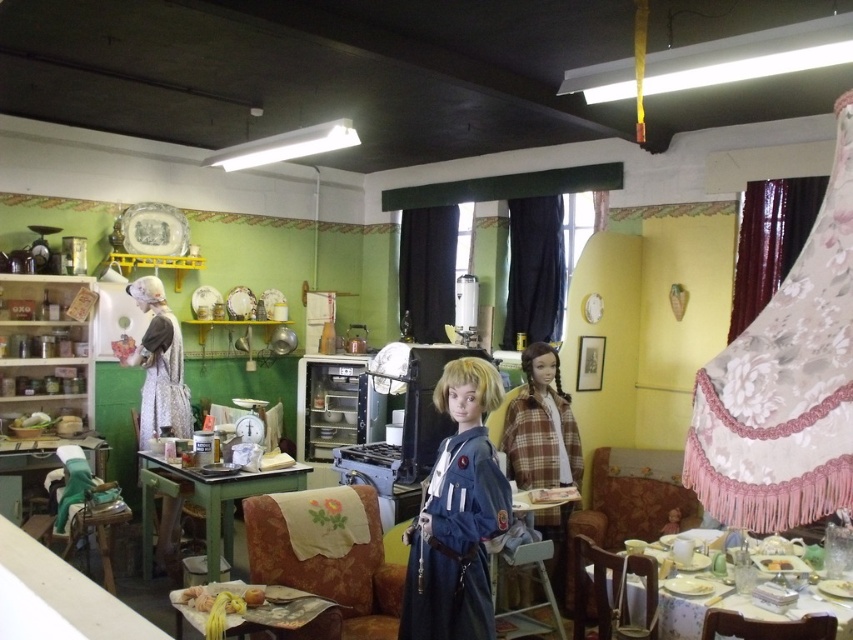
Question: Which of the following is the farthest from the observer?

Choices:
 (A) yellow matte apple at lower center
 (B) patterned fabric table at lower right
 (C) plaid fabric doll at center
 (D) wooden table with cloth at lower left

Answer: (C)

Question: Is green painted wood table at lower left positioned in front of patterned fabric table at lower right?

Choices:
 (A) yes
 (B) no

Answer: (B)

Question: Which point appears farthest from the camera in this image?

Choices:
 (A) (167, 321)
 (B) (511, 432)
 (C) (762, 564)

Answer: (A)

Question: Is blue fabric doll at center positioned behind green painted wood table at lower left?

Choices:
 (A) yes
 (B) no

Answer: (B)

Question: Which object is positioned farthest from the patterned fabric table at lower right?

Choices:
 (A) wooden table with cloth at lower left
 (B) white lace dress at left

Answer: (B)

Question: Can you confirm if plaid fabric doll at center is positioned below green painted wood table at lower left?

Choices:
 (A) yes
 (B) no

Answer: (B)